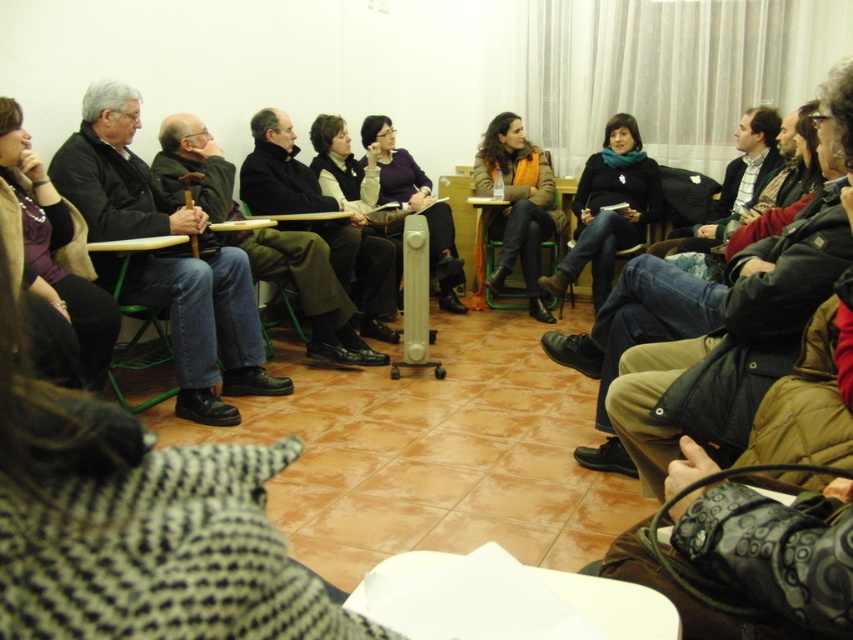
Who is shorter, matte black sweater at center or green plastic chair at left?

With less height is green plastic chair at left.

Can you confirm if matte black sweater at center is positioned below green plastic chair at left?

No.

Does point (608, 189) come closer to viewer compared to point (167, 353)?

No, (608, 189) is further to viewer.

You are a GUI agent. You are given a task and a screenshot of the screen. Output one action in this format:
    pyautogui.click(x=<x>, y=<y>)
    Task: Click on the matte black sweater at center
    This screenshot has width=853, height=640.
    Given the screenshot: What is the action you would take?
    pyautogui.click(x=608, y=209)

Find the location of a particular element. This screenshot has height=640, width=853. matte purple sweater at center is located at coordinates (416, 205).

Based on the photo, can you confirm if matte purple sweater at center is bigger than green plastic chair at left?

Yes, matte purple sweater at center is bigger than green plastic chair at left.

Is point (463, 312) positioned before point (115, 280)?

That is False.

This screenshot has width=853, height=640. Identify the location of matte purple sweater at center. (416, 205).

What do you see at coordinates (608, 209) in the screenshot?
I see `matte black sweater at center` at bounding box center [608, 209].

Is matte black sweater at center to the right of matte purple sweater at center from the viewer's perspective?

Correct, you'll find matte black sweater at center to the right of matte purple sweater at center.

What do you see at coordinates (608, 209) in the screenshot? This screenshot has width=853, height=640. I see `matte black sweater at center` at bounding box center [608, 209].

Image resolution: width=853 pixels, height=640 pixels. What are the coordinates of `matte black sweater at center` in the screenshot? It's located at (608, 209).